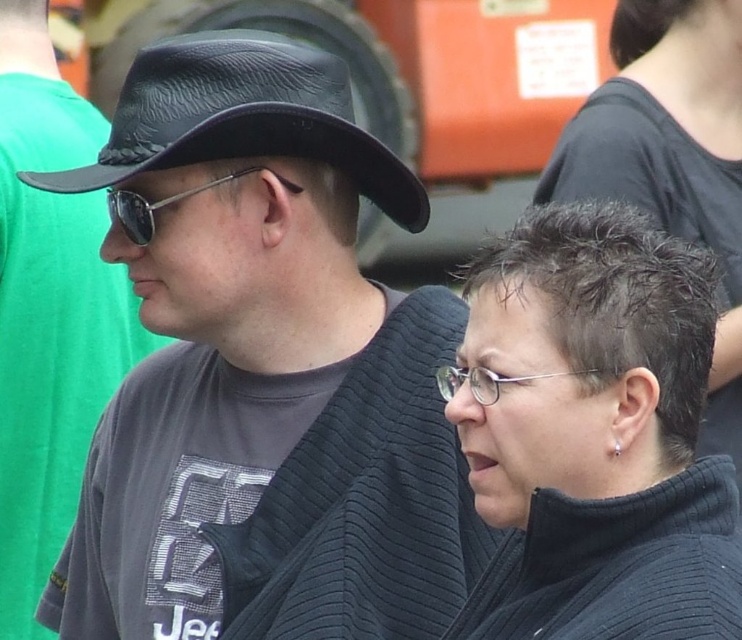
Question: Which object appears farthest from the camera in this image?

Choices:
 (A) black knit sweater at lower right
 (B) black leather hat at left
 (C) sunglasses at center

Answer: (C)

Question: Which of these objects is positioned closest to the sunglasses at center?

Choices:
 (A) matte black hat at left
 (B) black matte hair at center
 (C) black leather hat at left

Answer: (C)

Question: Does black leather hat at left have a smaller size compared to black knit sweater at lower right?

Choices:
 (A) no
 (B) yes

Answer: (A)

Question: Can you confirm if black leather hat at left is wider than sunglasses at center?

Choices:
 (A) yes
 (B) no

Answer: (A)

Question: Is black knit sweater at lower right to the left of black matte hair at center from the viewer's perspective?

Choices:
 (A) no
 (B) yes

Answer: (B)

Question: Which point is closer to the camera?

Choices:
 (A) (53, 289)
 (B) (283, 454)

Answer: (B)